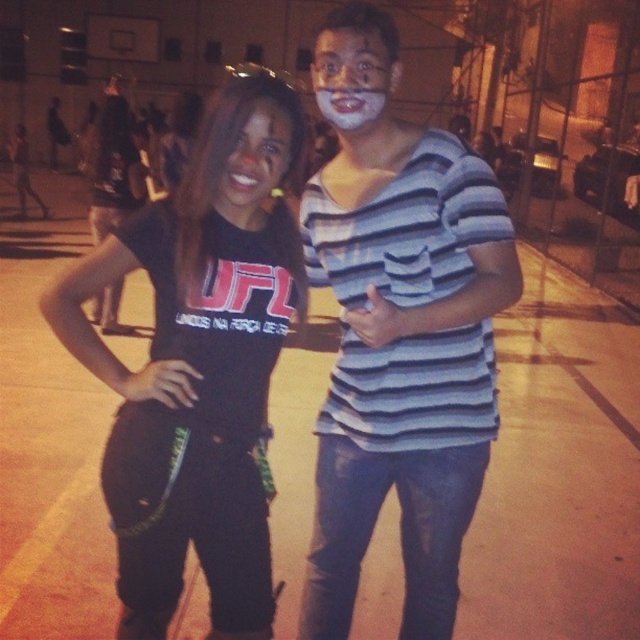
You are a photographer taking a picture of two people in a gym. You notice the striped cotton shirt at center and the white matte face at center. Which object is closer to the camera?

The striped cotton shirt at center is positioned under the white matte face at center, so the white matte face at center is closer to the camera.

You are standing in the gymnasium and see a point marked at coordinates (397, 332). What object is located at that point?

The point at coordinates (397, 332) indicates the location of the striped cotton shirt at center.